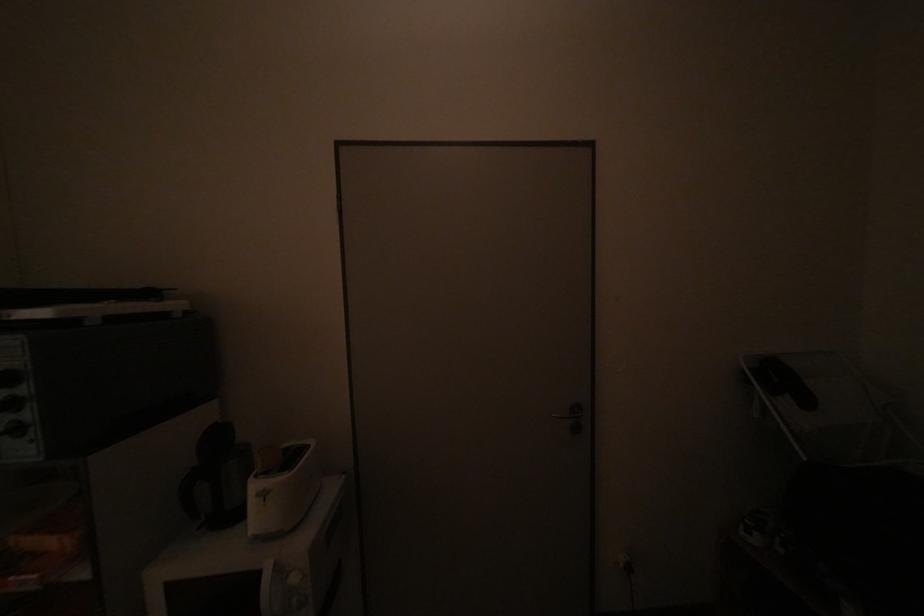
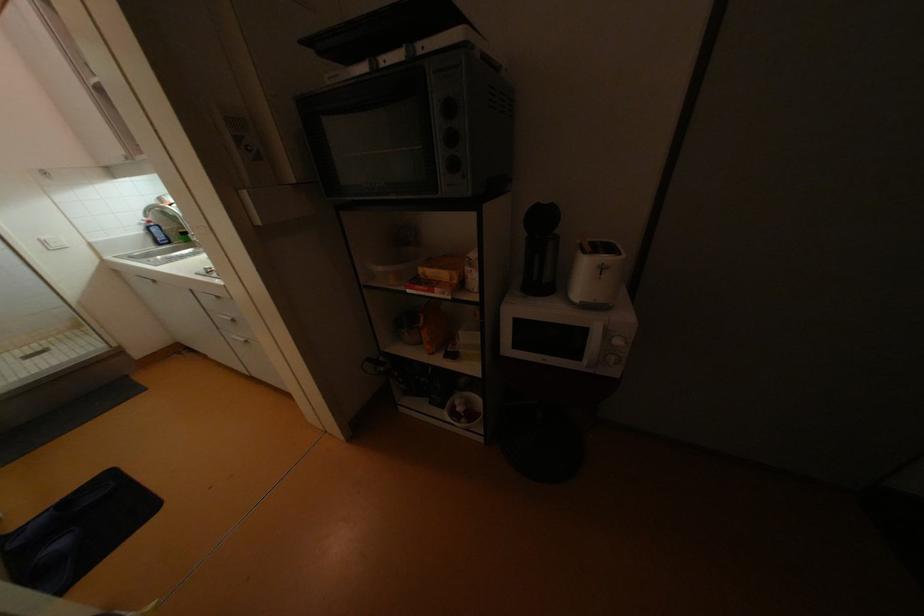
Where in the second image is the point corresponding to point 299,580 from the first image?

(623, 342)